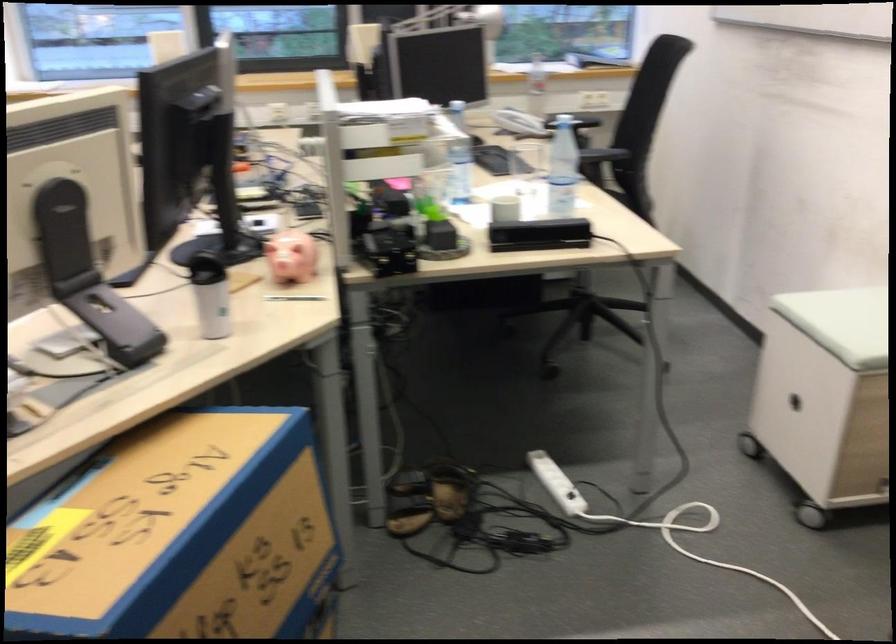
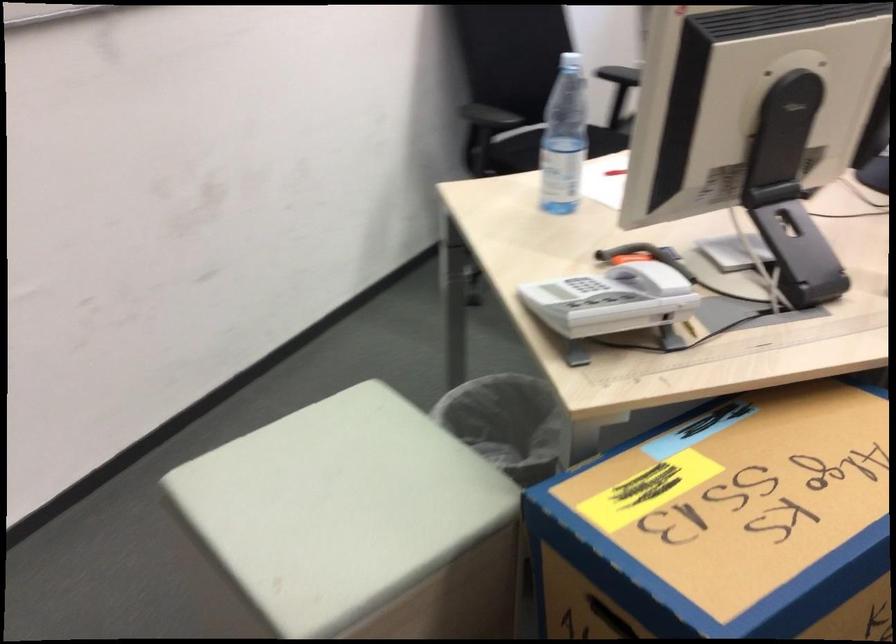
Question: I am providing you with two images of the same scene from different viewpoints. After the viewpoint changes to image2, which objects are now occluded?

Choices:
 (A) black chair armrest
 (B) padded stool surface
 (C) plastic water bottle
 (D) none of these

Answer: (D)